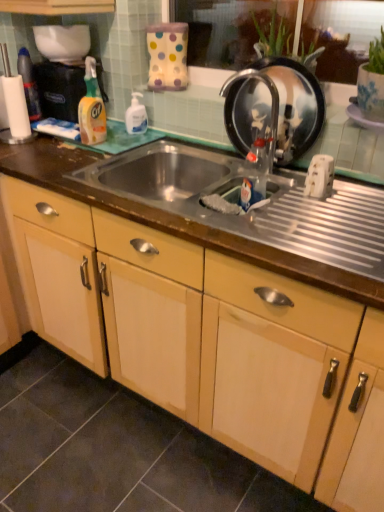
Question: Is polka dot fabric bag at upper center, the second appliance from the bottom, to the left or to the right of translucent plastic bottle at center, which is counted as the 2th bottle, starting from the left, in the image?

Choices:
 (A) left
 (B) right

Answer: (A)

Question: From the image's perspective, is polka dot fabric bag at upper center, acting as the 1th appliance starting from the top, positioned above or below translucent plastic bottle at center, arranged as the 1th bottle when viewed from the right?

Choices:
 (A) above
 (B) below

Answer: (A)

Question: Which object is the farthest from the silver metallic faucet at upper center?

Choices:
 (A) translucent plastic bottle at upper left, which is the first bottle from top to bottom
 (B) metallic silver frying pan at upper right, placed as the second appliance when sorted from top to bottom
 (C) stainless steel sink at center
 (D) wooden cabinet at center
 (E) translucent plastic bottle at center, which ranks as the 2th bottle in back-to-front order

Answer: (A)

Question: Which object is the farthest from the yellow plastic spray bottle at left, acting as the first cleaning product starting from the left?

Choices:
 (A) white glossy pump bottle at upper center, which is the 1th cleaning product from right to left
 (B) silver metallic faucet at upper center
 (C) polka dot fabric bag at upper center, the second appliance from the bottom
 (D) stainless steel sink at center
 (E) metallic silver frying pan at upper right, placed as the 2th appliance when sorted from left to right

Answer: (E)